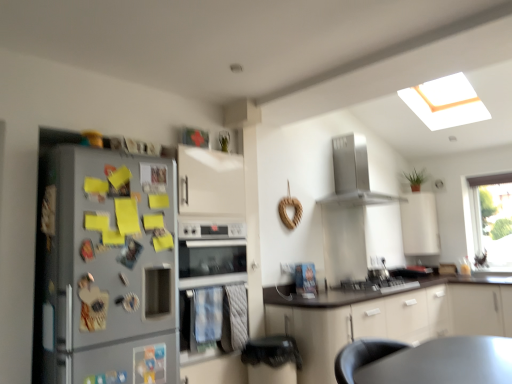
Question: Does silver metallic oven at center turn towards satin silver gas stove at center?

Choices:
 (A) yes
 (B) no

Answer: (B)

Question: Is the depth of silver metallic oven at center less than that of satin silver gas stove at center?

Choices:
 (A) no
 (B) yes

Answer: (B)

Question: Considering the relative sizes of silver metallic oven at center and satin silver gas stove at center in the image provided, is silver metallic oven at center smaller than satin silver gas stove at center?

Choices:
 (A) no
 (B) yes

Answer: (A)

Question: Is silver metallic oven at center positioned beyond the bounds of satin silver gas stove at center?

Choices:
 (A) yes
 (B) no

Answer: (A)

Question: Would you consider silver metallic oven at center to be distant from satin silver gas stove at center?

Choices:
 (A) no
 (B) yes

Answer: (B)

Question: From a real-world perspective, is silver metallic oven at center above or below satin silver gas stove at center?

Choices:
 (A) below
 (B) above

Answer: (B)

Question: Relative to satin silver gas stove at center, is silver metallic oven at center in front or behind?

Choices:
 (A) behind
 (B) front

Answer: (B)

Question: Is point (231, 248) positioned closer to the camera than point (371, 288)?

Choices:
 (A) farther
 (B) closer

Answer: (B)

Question: Is silver metallic oven at center spatially inside satin silver gas stove at center, or outside of it?

Choices:
 (A) inside
 (B) outside

Answer: (B)

Question: Considering the positions of silver metallic refrigerator at left and satin silver gas stove at center in the image, is silver metallic refrigerator at left bigger or smaller than satin silver gas stove at center?

Choices:
 (A) big
 (B) small

Answer: (A)

Question: Looking at their shapes, would you say silver metallic refrigerator at left is wider or thinner than satin silver gas stove at center?

Choices:
 (A) thin
 (B) wide

Answer: (A)

Question: From the image's perspective, is silver metallic refrigerator at left located above or below satin silver gas stove at center?

Choices:
 (A) below
 (B) above

Answer: (B)

Question: Relative to satin silver gas stove at center, is silver metallic refrigerator at left in front or behind?

Choices:
 (A) behind
 (B) front

Answer: (B)

Question: From the image's perspective, relative to satin silver gas stove at center, is satin silver range hood at upper center above or below?

Choices:
 (A) above
 (B) below

Answer: (A)

Question: From a real-world perspective, is satin silver range hood at upper center physically located above or below satin silver gas stove at center?

Choices:
 (A) below
 (B) above

Answer: (B)